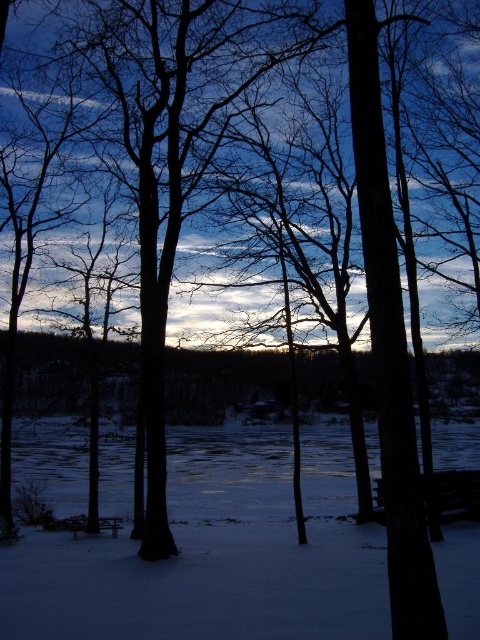
From the picture: You are a snowplow operator who needs to clear the snow from the wooden park bench at lower center. Based on the scene, can you determine if the snow on the white powdery snow at center is deeper than the bench? Please explain.

The white powdery snow at center has a greater height compared to the wooden park bench at lower center, meaning the snow there is deeper than the bench. Therefore, the snowplow operator will need to clear the snow from the area around the bench as it is buried under deeper snow.

You are planning to build a snowman using the white powdery snow at center and need to sit on the wooden park bench at lower center to rest. Can you determine if the snow at center has enough material to build a medium sized snowman?

The white powdery snow at center is bigger than the wooden park bench at lower center, so there is likely enough material to build a medium sized snowman.

You are a photographer setting up a tripod to capture the reflection of the trees in the water. The wooden park bench at lower center is in your way. Can you move the bench to the side to get a better shot? Consider the space between the bench and the white powdery snow at center.

The white powdery snow at center is wider than the wooden park bench at lower center, so there is enough space to move the bench to the side without obstructing the snow area.